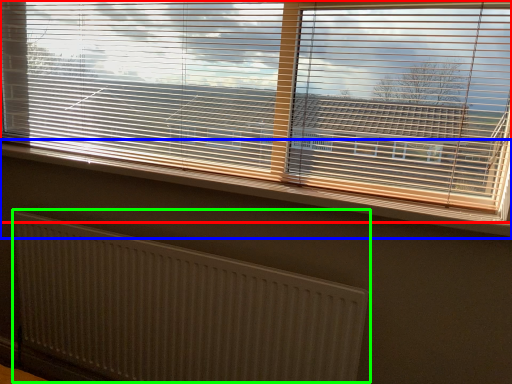
Question: Which object is positioned farthest from window blind (highlighted by a red box)? Select from window sill (highlighted by a blue box) and radiator (highlighted by a green box).

Choices:
 (A) window sill
 (B) radiator

Answer: (B)